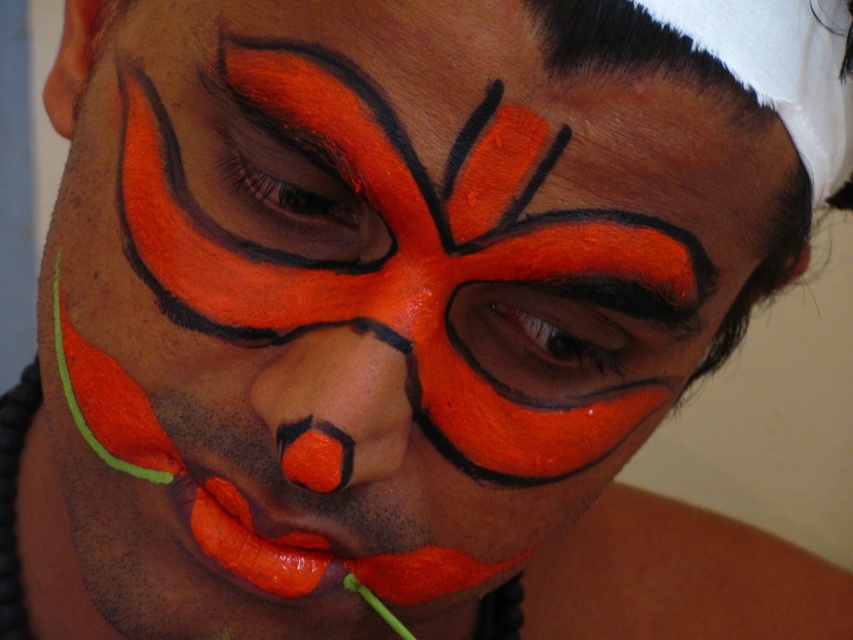
Question: Is the position of matte orange face paint at upper center less distant than that of matte orange lips at center?

Choices:
 (A) yes
 (B) no

Answer: (A)

Question: Is matte orange nose at center smaller than matte orange lips at center?

Choices:
 (A) yes
 (B) no

Answer: (B)

Question: Among these objects, which one is farthest from the camera?

Choices:
 (A) matte orange lips at center
 (B) matte orange nose at center

Answer: (A)

Question: Which point appears farthest from the camera in this image?

Choices:
 (A) (309, 205)
 (B) (345, 358)
 (C) (235, 529)

Answer: (C)

Question: Which object is positioned farthest from the matte orange nose at center?

Choices:
 (A) matte orange lips at center
 (B) matte orange face paint at upper center

Answer: (B)

Question: Can you confirm if matte orange face paint at upper center is bigger than matte orange lips at center?

Choices:
 (A) no
 (B) yes

Answer: (B)